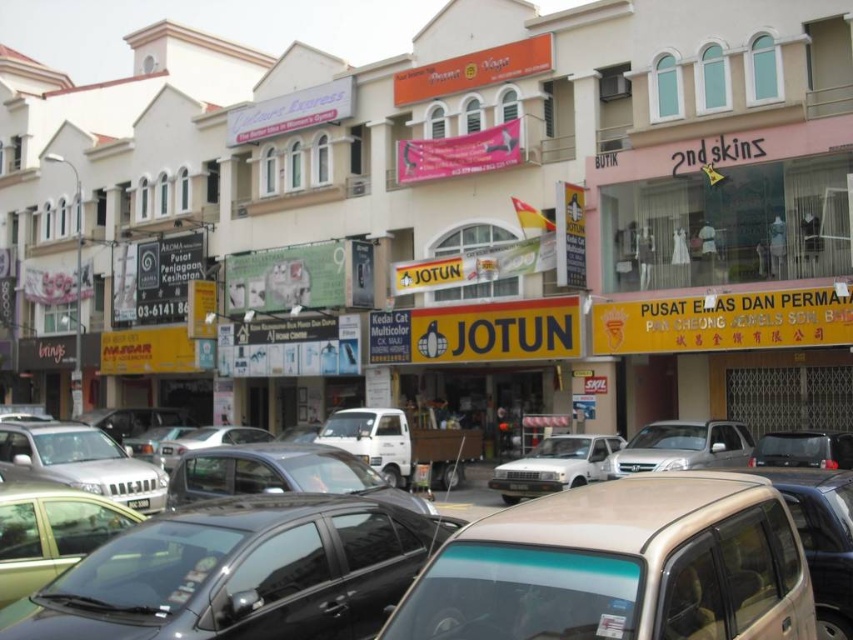
Question: Which object appears closest to the camera in this image?

Choices:
 (A) metallic silver car at center
 (B) white matte car at center
 (C) silver metallic car at center
 (D) black plastic license plate at center

Answer: (A)

Question: Is silver metallic car at center bigger than black plastic license plate at center?

Choices:
 (A) yes
 (B) no

Answer: (A)

Question: Can you confirm if metallic silver car at center is wider than white matte car at center?

Choices:
 (A) no
 (B) yes

Answer: (A)

Question: Can you confirm if metallic silver car at center is positioned to the right of satin beige car at center?

Choices:
 (A) no
 (B) yes

Answer: (B)

Question: Which point appears closest to the camera in this image?

Choices:
 (A) (498, 486)
 (B) (459, 586)
 (C) (715, 432)
 (D) (469, 614)

Answer: (D)

Question: Among these objects, which one is farthest from the camera?

Choices:
 (A) silver metallic car at center
 (B) black plastic license plate at center
 (C) white matte car at center
 (D) metallic silver car at center

Answer: (C)